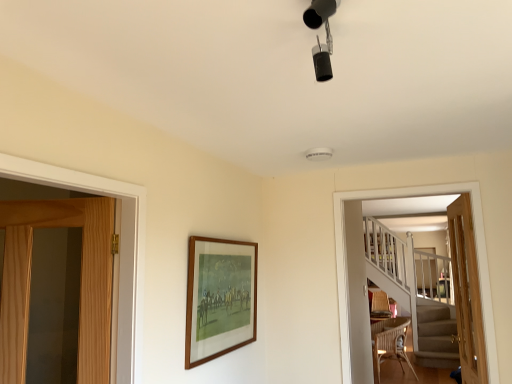
Question: Can you confirm if wooden screen door at right is taller than light wood door at right, the 2th door viewed from the left?

Choices:
 (A) no
 (B) yes

Answer: (A)

Question: Can you confirm if wooden screen door at right is thinner than light wood door at right, which is the first door in right-to-left order?

Choices:
 (A) no
 (B) yes

Answer: (A)

Question: Is wooden screen door at right positioned with its back to light wood door at right, which is the first door in right-to-left order?

Choices:
 (A) no
 (B) yes

Answer: (B)

Question: Is wooden screen door at right further to the viewer compared to light wood door at right, the 2th door viewed from the left?

Choices:
 (A) no
 (B) yes

Answer: (A)

Question: Is wooden screen door at right positioned far away from light wood door at right, the 2th door viewed from the left?

Choices:
 (A) no
 (B) yes

Answer: (A)

Question: Considering the relative sizes of wooden screen door at right and light wood door at right, which is the first door in right-to-left order, in the image provided, is wooden screen door at right smaller than light wood door at right, which is the first door in right-to-left order,?

Choices:
 (A) yes
 (B) no

Answer: (A)

Question: Can you confirm if woven brown chair at lower right is thinner than wicker armchair at lower right?

Choices:
 (A) yes
 (B) no

Answer: (A)

Question: Is woven brown chair at lower right outside wicker armchair at lower right?

Choices:
 (A) no
 (B) yes

Answer: (B)

Question: From the image's perspective, would you say woven brown chair at lower right is positioned over wicker armchair at lower right?

Choices:
 (A) no
 (B) yes

Answer: (B)

Question: Is woven brown chair at lower right bigger than wicker armchair at lower right?

Choices:
 (A) yes
 (B) no

Answer: (A)

Question: Does woven brown chair at lower right turn towards wicker armchair at lower right?

Choices:
 (A) yes
 (B) no

Answer: (B)

Question: From a real-world perspective, is woven brown chair at lower right positioned over wicker armchair at lower right based on gravity?

Choices:
 (A) yes
 (B) no

Answer: (B)

Question: Is wicker armchair at lower right next to wooden frame at center and touching it?

Choices:
 (A) no
 (B) yes

Answer: (A)